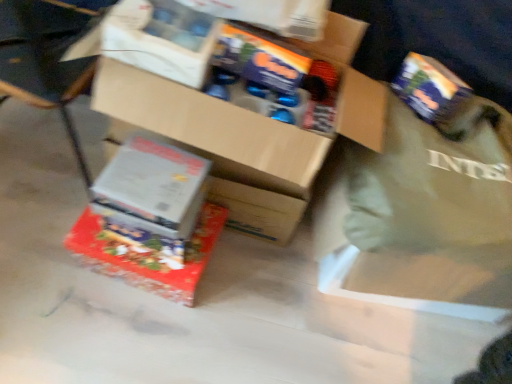
I want to click on free space to the left of shiny metallic box at center, positioned as the first box in bottom-to-top order, so click(x=47, y=235).